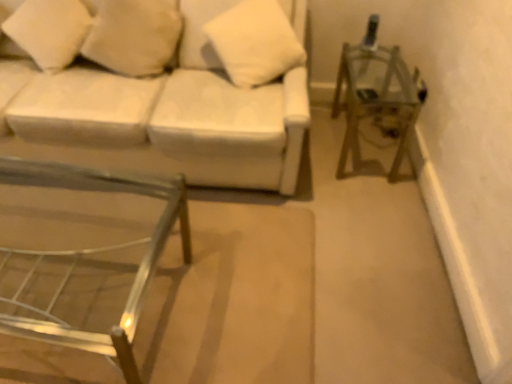
Find the location of `metallic silver table at lower left`. metallic silver table at lower left is located at coordinates (102, 250).

The width and height of the screenshot is (512, 384). What do you see at coordinates (378, 95) in the screenshot? I see `metallic silver side table at right` at bounding box center [378, 95].

The image size is (512, 384). What do you see at coordinates (49, 31) in the screenshot?
I see `white soft pillow at upper left, acting as the first pillow starting from the left` at bounding box center [49, 31].

Locate an element on the screen. white soft pillow at upper left, marked as the 3th pillow in a right-to-left arrangement is located at coordinates (49, 31).

The width and height of the screenshot is (512, 384). In order to click on white soft pillow at upper left, the second pillow viewed from the right in this screenshot , I will do `click(134, 36)`.

Which is correct: white soft pillow at upper center, which is the 3th pillow in left-to-right order, is inside metallic silver table at lower left, or outside of it?

white soft pillow at upper center, which is the 3th pillow in left-to-right order, lies outside metallic silver table at lower left.

Can you confirm if white soft pillow at upper center, arranged as the 1th pillow when viewed from the right, is taller than metallic silver table at lower left?

Incorrect, the height of white soft pillow at upper center, arranged as the 1th pillow when viewed from the right, is not larger of that of metallic silver table at lower left.

From the image's perspective, which is below, white soft pillow at upper center, arranged as the 1th pillow when viewed from the right, or metallic silver table at lower left?

metallic silver table at lower left appears lower in the image.

Which is in front, point (234, 34) or point (61, 328)?

The point (61, 328) is closer to the camera.

From a real-world perspective, between white soft pillow at upper left, the second pillow viewed from the right, and white soft pillow at upper left, acting as the first pillow starting from the left, who is vertically lower?

In real-world perspective, white soft pillow at upper left, the second pillow viewed from the right, is lower.

Consider the image. Is white soft pillow at upper left, the second pillow viewed from the right, positioned before white soft pillow at upper left, marked as the 3th pillow in a right-to-left arrangement?

No, white soft pillow at upper left, the second pillow viewed from the right, is further to the viewer.

Who is taller, white soft pillow at upper left, arranged as the second pillow when viewed from the left, or white soft pillow at upper left, acting as the first pillow starting from the left?

With more height is white soft pillow at upper left, arranged as the second pillow when viewed from the left.

Based on their sizes in the image, would you say white soft pillow at upper left, arranged as the second pillow when viewed from the left, is bigger or smaller than white soft pillow at upper left, marked as the 3th pillow in a right-to-left arrangement?

white soft pillow at upper left, arranged as the second pillow when viewed from the left, is smaller than white soft pillow at upper left, marked as the 3th pillow in a right-to-left arrangement.

Looking at this image, from the image's perspective, which one is positioned lower, white fabric couch at upper left or white soft pillow at upper left, arranged as the second pillow when viewed from the left?

white fabric couch at upper left is shown below in the image.

Can you confirm if white fabric couch at upper left is bigger than white soft pillow at upper left, the second pillow viewed from the right?

Yes, white fabric couch at upper left is bigger than white soft pillow at upper left, the second pillow viewed from the right.

Considering the sizes of white fabric couch at upper left and white soft pillow at upper left, arranged as the second pillow when viewed from the left, in the image, is white fabric couch at upper left wider or thinner than white soft pillow at upper left, arranged as the second pillow when viewed from the left,?

Considering their sizes, white fabric couch at upper left looks broader than white soft pillow at upper left, arranged as the second pillow when viewed from the left.

Which object is closer to the camera, metallic silver side table at right or white fabric couch at upper left?

Positioned in front is white fabric couch at upper left.

Looking at this image, is metallic silver side table at right outside of white fabric couch at upper left?

metallic silver side table at right is positioned outside white fabric couch at upper left.

In the image, there is a white fabric couch at upper left. At what (x,y) coordinates should I click in order to perform the action: click on side table below it (from a real-world perspective). Please return your answer as a coordinate pair (x, y). This screenshot has width=512, height=384. Looking at the image, I should click on (378, 95).

Is metallic silver table at lower left taller than white soft pillow at upper center, which is the 3th pillow in left-to-right order?

Correct, metallic silver table at lower left is much taller as white soft pillow at upper center, which is the 3th pillow in left-to-right order.

Is metallic silver table at lower left spatially inside white soft pillow at upper center, arranged as the 1th pillow when viewed from the right, or outside of it?

metallic silver table at lower left cannot be found inside white soft pillow at upper center, arranged as the 1th pillow when viewed from the right.

Which is behind, point (113, 341) or point (226, 51)?

Positioned behind is point (226, 51).

How many degrees apart are the facing directions of metallic silver side table at right and white soft pillow at upper center, which is the 3th pillow in left-to-right order?

There is a 1.83-degree angle between the facing directions of metallic silver side table at right and white soft pillow at upper center, which is the 3th pillow in left-to-right order.

Considering the relative sizes of metallic silver side table at right and white soft pillow at upper center, which is the 3th pillow in left-to-right order, in the image provided, is metallic silver side table at right bigger than white soft pillow at upper center, which is the 3th pillow in left-to-right order,?

Yes, metallic silver side table at right is bigger than white soft pillow at upper center, which is the 3th pillow in left-to-right order.

Is metallic silver side table at right at the right side of white soft pillow at upper center, arranged as the 1th pillow when viewed from the right?

Yes.

From the image's perspective, which one is positioned higher, metallic silver side table at right or white soft pillow at upper center, arranged as the 1th pillow when viewed from the right?

white soft pillow at upper center, arranged as the 1th pillow when viewed from the right.

Who is taller, white soft pillow at upper left, arranged as the second pillow when viewed from the left, or metallic silver table at lower left?

white soft pillow at upper left, arranged as the second pillow when viewed from the left, is taller.

Is white soft pillow at upper left, arranged as the second pillow when viewed from the left, looking in the opposite direction of metallic silver table at lower left?

No, white soft pillow at upper left, arranged as the second pillow when viewed from the left,'s orientation is not away from metallic silver table at lower left.

Is white soft pillow at upper left, the second pillow viewed from the right, spatially inside metallic silver table at lower left, or outside of it?

white soft pillow at upper left, the second pillow viewed from the right, cannot be found inside metallic silver table at lower left.

Where is `table that is on the left side of white soft pillow at upper left, arranged as the second pillow when viewed from the left`? table that is on the left side of white soft pillow at upper left, arranged as the second pillow when viewed from the left is located at coordinates (102, 250).

This screenshot has width=512, height=384. I want to click on table that appears below the white soft pillow at upper center, arranged as the 1th pillow when viewed from the right (from a real-world perspective), so click(x=102, y=250).

I want to click on pillow behind the white soft pillow at upper left, acting as the first pillow starting from the left, so click(134, 36).

Looking at the image, which one is located further to white soft pillow at upper left, the second pillow viewed from the right, metallic silver side table at right or white soft pillow at upper center, which is the 3th pillow in left-to-right order?

Among the two, metallic silver side table at right is located further to white soft pillow at upper left, the second pillow viewed from the right.

Based on the photo, when comparing their distances from white soft pillow at upper left, arranged as the second pillow when viewed from the left, does metallic silver table at lower left or metallic silver side table at right seem closer?

Among the two, metallic silver table at lower left is located nearer to white soft pillow at upper left, arranged as the second pillow when viewed from the left.

When comparing their distances from white soft pillow at upper center, which is the 3th pillow in left-to-right order, does white fabric couch at upper left or white soft pillow at upper left, the second pillow viewed from the right, seem closer?

white fabric couch at upper left.

Estimate the real-world distances between objects in this image. Which object is closer to metallic silver table at lower left, metallic silver side table at right or white soft pillow at upper left, arranged as the second pillow when viewed from the left?

The object closer to metallic silver table at lower left is white soft pillow at upper left, arranged as the second pillow when viewed from the left.

In the scene shown: From the image, which object appears to be nearer to metallic silver table at lower left, metallic silver side table at right or white fabric couch at upper left?

Among the two, white fabric couch at upper left is located nearer to metallic silver table at lower left.

Looking at the image, which one is located further to white fabric couch at upper left, white soft pillow at upper center, arranged as the 1th pillow when viewed from the right, or white soft pillow at upper left, marked as the 3th pillow in a right-to-left arrangement?

Based on the image, white soft pillow at upper left, marked as the 3th pillow in a right-to-left arrangement, appears to be further to white fabric couch at upper left.

Considering their positions, is white soft pillow at upper center, which is the 3th pillow in left-to-right order, positioned further to white soft pillow at upper left, arranged as the second pillow when viewed from the left, than metallic silver side table at right?

Based on the image, metallic silver side table at right appears to be further to white soft pillow at upper left, arranged as the second pillow when viewed from the left.

Which object lies further to the anchor point white soft pillow at upper left, marked as the 3th pillow in a right-to-left arrangement, white fabric couch at upper left or metallic silver table at lower left?

Among the two, metallic silver table at lower left is located further to white soft pillow at upper left, marked as the 3th pillow in a right-to-left arrangement.

You are a GUI agent. You are given a task and a screenshot of the screen. Output one action in this format:
    pyautogui.click(x=<x>, y=<y>)
    Task: Click on the pillow between white soft pillow at upper left, the second pillow viewed from the right, and metallic silver table at lower left, in the vertical direction
    The width and height of the screenshot is (512, 384).
    Given the screenshot: What is the action you would take?
    pyautogui.click(x=255, y=42)

Locate an element on the screen. pillow between white fabric couch at upper left and white soft pillow at upper center, which is the 3th pillow in left-to-right order, in the horizontal direction is located at coordinates pos(134,36).

Find the location of a particular element. The width and height of the screenshot is (512, 384). pillow situated between white soft pillow at upper left, the second pillow viewed from the right, and metallic silver side table at right from left to right is located at coordinates (255, 42).

Image resolution: width=512 pixels, height=384 pixels. I want to click on studio couch between white soft pillow at upper left, marked as the 3th pillow in a right-to-left arrangement, and metallic silver table at lower left in the up-down direction, so click(167, 117).